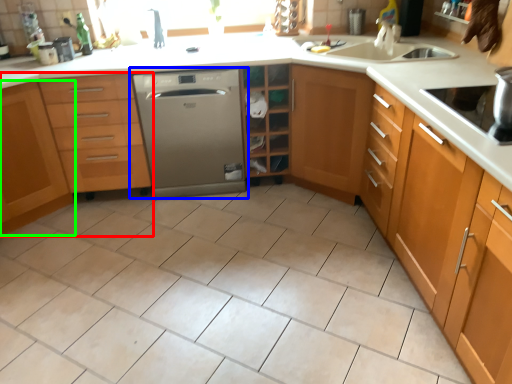
Question: Which object is the closest to the cabinetry (highlighted by a red box)? Choose among these: home appliance (highlighted by a blue box) or cabinetry (highlighted by a green box).

Choices:
 (A) home appliance
 (B) cabinetry

Answer: (B)